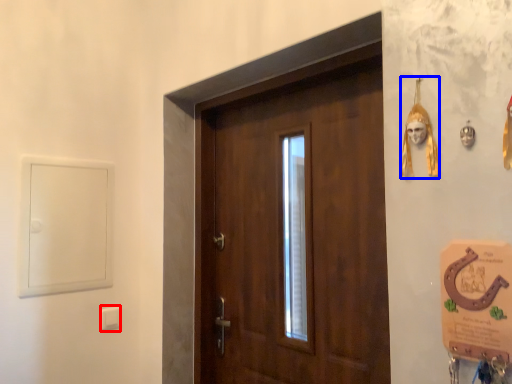
Question: Which of the following is the farthest to the observer, light switch (highlighted by a red box) or decor (highlighted by a blue box)?

Choices:
 (A) light switch
 (B) decor

Answer: (A)